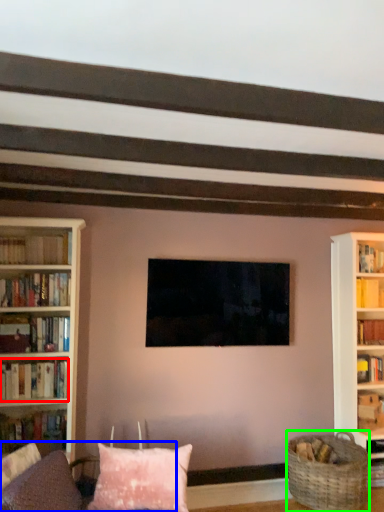
Question: Which object is positioned closest to book (highlighted by a red box)? Select from couch (highlighted by a blue box) and basket (highlighted by a green box).

Choices:
 (A) couch
 (B) basket

Answer: (A)